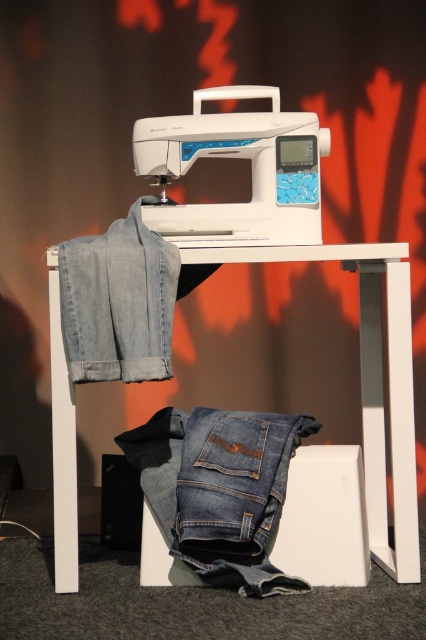
At what (x,y) coordinates should I click in order to perform the action: click on white plastic table at center. Please return your answer as a coordinate pair (x, y). Image resolution: width=426 pixels, height=640 pixels. Looking at the image, I should click on (370, 381).

Is white plastic table at center wider than denim at center?

Indeed, white plastic table at center has a greater width compared to denim at center.

Who is more distant from viewer, (400, 262) or (233, 548)?

Point (233, 548)

Where is `white plastic table at center`? This screenshot has height=640, width=426. white plastic table at center is located at coordinates (370, 381).

Who is positioned more to the right, white plastic table at center or white plastic sewing machine at center?

white plastic table at center is more to the right.

Between point (374, 298) and point (238, 125), which one is positioned behind?

The point (374, 298) is behind.

I want to click on white plastic table at center, so tap(370, 381).

In the scene shown: How much distance is there between denim at center and white plastic sewing machine at center?

denim at center is 19.36 inches from white plastic sewing machine at center.

Between denim at center and white plastic sewing machine at center, which one has more height?

Answer: denim at center is taller.

Where is `denim at center`? The image size is (426, 640). denim at center is located at coordinates (219, 490).

What are the coordinates of `denim at center` in the screenshot? It's located at (219, 490).